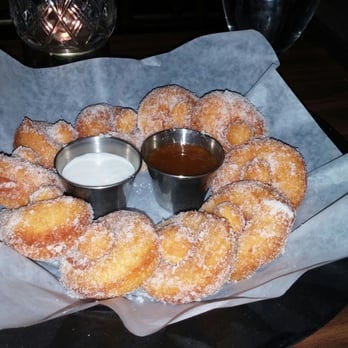
This screenshot has height=348, width=348. I want to click on cup, so click(x=96, y=172).